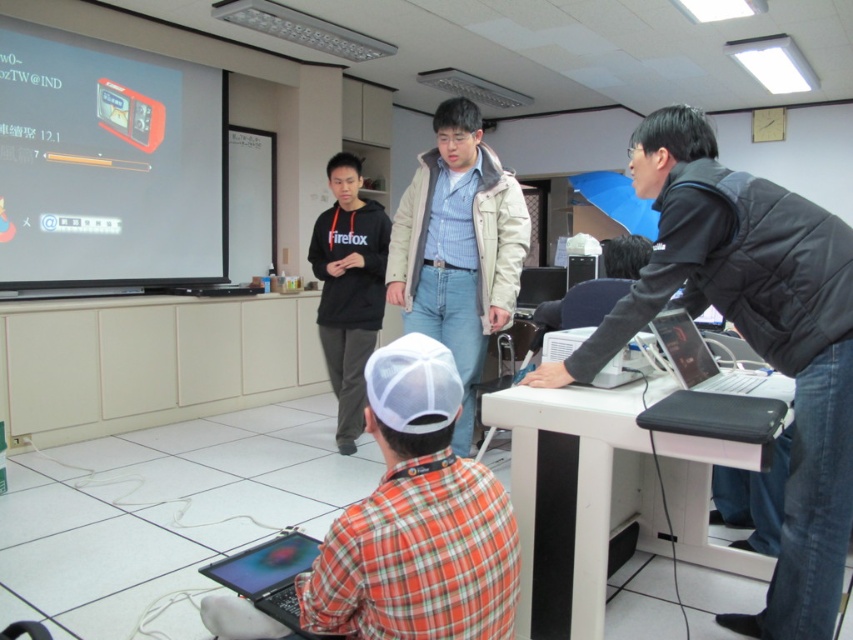
Is matte black projector screen at upper left wider than white plastic table at lower center?

No, matte black projector screen at upper left is not wider than white plastic table at lower center.

Who is more distant from viewer, (178, 136) or (674, 548)?

The point (178, 136) is more distant.

Is point (126, 205) behind point (703, 477)?

Yes, point (126, 205) is farther from viewer.

Where is `matte black projector screen at upper left`? Image resolution: width=853 pixels, height=640 pixels. matte black projector screen at upper left is located at coordinates (107, 164).

Is black matte jacket at right bigger than matte black projector screen at upper left?

No, black matte jacket at right is not bigger than matte black projector screen at upper left.

Measure the distance between point (680, 125) and camera.

A distance of 1.88 meters exists between point (680, 125) and camera.

Is point (746, 282) closer to viewer compared to point (155, 138)?

Yes, point (746, 282) is in front of point (155, 138).

This screenshot has height=640, width=853. In order to click on black matte jacket at right in this screenshot , I will do (752, 337).

Is matte black projector screen at upper left to the right of matte black laptop at lower center from the viewer's perspective?

In fact, matte black projector screen at upper left is to the left of matte black laptop at lower center.

Can you confirm if matte black projector screen at upper left is taller than matte black laptop at lower center?

Correct, matte black projector screen at upper left is much taller as matte black laptop at lower center.

Between point (202, 216) and point (234, 580), which one is positioned in front?

Point (234, 580) is more forward.

Where is `matte black projector screen at upper left`? The image size is (853, 640). matte black projector screen at upper left is located at coordinates (107, 164).